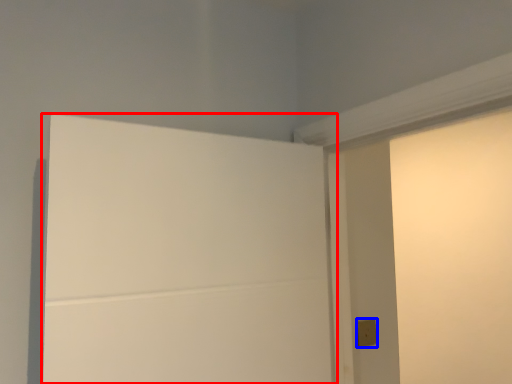
Question: Which of the following is the closest to the observer, door (highlighted by a red box) or light switch (highlighted by a blue box)?

Choices:
 (A) door
 (B) light switch

Answer: (A)